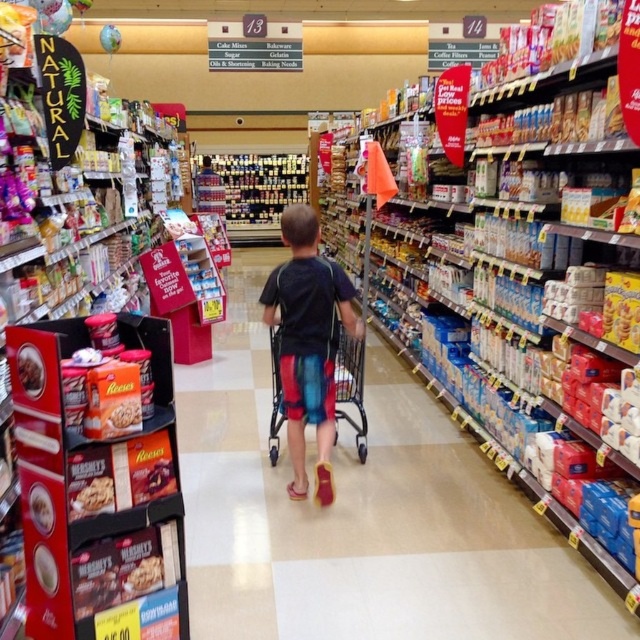
You are a store employee standing at the entrance of the aisle and notice both the matte black shirt at center and the metallic silver shopping cart at center. Which object is closer to you?

The matte black shirt at center is closer to you because it is in front of the metallic silver shopping cart at center.

You are a store employee organizing items on a shelf. You have a matte black shirt at center and a smooth chocolate bar at lower left. Which item should you place on the left side of the shelf if you want to maximize the space used efficiently?

The matte black shirt at center is wider than the smooth chocolate bar at lower left, so placing the wider item on the left side would allow for better space utilization.